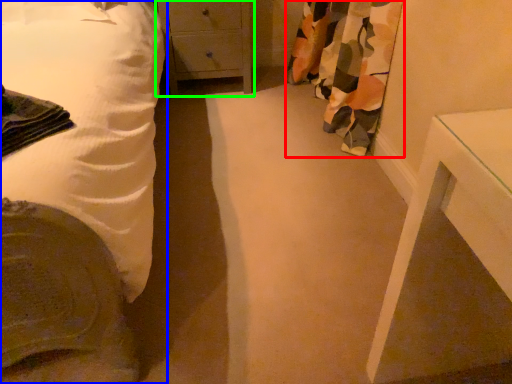
Question: Which object is the farthest from curtain (highlighted by a red box)? Choose among these: bed (highlighted by a blue box) or chest of drawers (highlighted by a green box).

Choices:
 (A) bed
 (B) chest of drawers

Answer: (A)